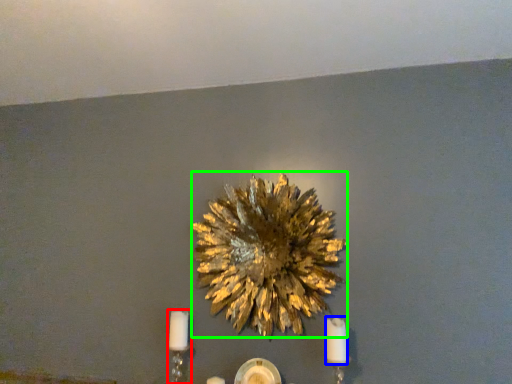
Question: Which is nearer to the candle holder (highlighted by a red box)? candle (highlighted by a blue box) or flower (highlighted by a green box).

Choices:
 (A) candle
 (B) flower

Answer: (B)